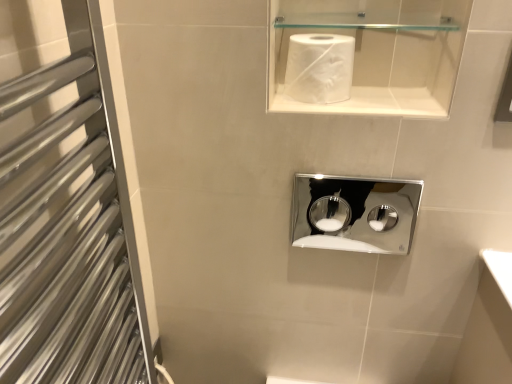
The image size is (512, 384). I want to click on white matte paper towel at upper center, so click(319, 68).

This screenshot has width=512, height=384. Identify the location of chrome/metallic medicine cabinet at center. (355, 213).

Based on the photo, visually, is silver metallic towel rack at left positioned to the left or to the right of chrome/metallic medicine cabinet at center?

Clearly, silver metallic towel rack at left is on the left of chrome/metallic medicine cabinet at center in the image.

From the image's perspective, who appears lower, silver metallic towel rack at left or chrome/metallic medicine cabinet at center?

silver metallic towel rack at left.

Considering the sizes of objects silver metallic towel rack at left and chrome/metallic medicine cabinet at center in the image provided, who is smaller, silver metallic towel rack at left or chrome/metallic medicine cabinet at center?

With smaller size is chrome/metallic medicine cabinet at center.

Between chrome/metallic medicine cabinet at center and white matte paper towel at upper center, which one has smaller size?

With smaller size is chrome/metallic medicine cabinet at center.

Find the location of a particular element. paper towel above the chrome/metallic medicine cabinet at center (from the image's perspective) is located at coordinates (319, 68).

From their relative heights in the image, would you say chrome/metallic medicine cabinet at center is taller or shorter than white matte paper towel at upper center?

chrome/metallic medicine cabinet at center is taller than white matte paper towel at upper center.

Is chrome/metallic medicine cabinet at center in front of or behind white matte paper towel at upper center in the image?

chrome/metallic medicine cabinet at center is positioned farther from the viewer than white matte paper towel at upper center.

Can you confirm if white matte paper towel at upper center is thinner than chrome/metallic medicine cabinet at center?

Incorrect, the width of white matte paper towel at upper center is not less than that of chrome/metallic medicine cabinet at center.

Can we say white matte paper towel at upper center lies outside chrome/metallic medicine cabinet at center?

Yes, white matte paper towel at upper center is not within chrome/metallic medicine cabinet at center.

From the picture: What's the angular difference between white matte paper towel at upper center and chrome/metallic medicine cabinet at center's facing directions?

white matte paper towel at upper center and chrome/metallic medicine cabinet at center are facing 1.37 degrees away from each other.

Does point (324, 54) come in front of point (393, 218)?

That is True.

How many degrees apart are the facing directions of silver metallic towel rack at left and white matte paper towel at upper center?

The angle between the facing direction of silver metallic towel rack at left and the facing direction of white matte paper towel at upper center is 88.9 degrees.

Which of these two, silver metallic towel rack at left or white matte paper towel at upper center, is smaller?

white matte paper towel at upper center is smaller.

Which point is more distant from viewer, (75, 164) or (344, 98)?

Point (344, 98)

Which object is positioned more to the right, silver metallic towel rack at left or white matte paper towel at upper center?

From the viewer's perspective, white matte paper towel at upper center appears more on the right side.

From a real-world perspective, is chrome/metallic medicine cabinet at center physically located above or below silver metallic towel rack at left?

chrome/metallic medicine cabinet at center is situated lower than silver metallic towel rack at left in the real world.

Is silver metallic towel rack at left located within chrome/metallic medicine cabinet at center?

No, silver metallic towel rack at left is not a part of chrome/metallic medicine cabinet at center.

Does point (302, 50) lie in front of point (127, 327)?

That is True.

Is white matte paper towel at upper center facing away from silver metallic towel rack at left?

white matte paper towel at upper center is not turned away from silver metallic towel rack at left.

How much distance is there between white matte paper towel at upper center and silver metallic towel rack at left?

white matte paper towel at upper center and silver metallic towel rack at left are 18.36 inches apart.

Would you say white matte paper towel at upper center is to the left or to the right of silver metallic towel rack at left in the picture?

Clearly, white matte paper towel at upper center is on the right of silver metallic towel rack at left in the image.

Identify the location of medicine cabinet lying behind the silver metallic towel rack at left. (355, 213).

Identify the location of medicine cabinet on the right of white matte paper towel at upper center. The width and height of the screenshot is (512, 384). (355, 213).

From the image, which object appears to be farther from white matte paper towel at upper center, silver metallic towel rack at left or chrome/metallic medicine cabinet at center?

Among the two, chrome/metallic medicine cabinet at center is located further to white matte paper towel at upper center.

When comparing their distances from white matte paper towel at upper center, does chrome/metallic medicine cabinet at center or silver metallic towel rack at left seem closer?

Based on the image, silver metallic towel rack at left appears to be nearer to white matte paper towel at upper center.

Considering their positions, is silver metallic towel rack at left positioned further to chrome/metallic medicine cabinet at center than white matte paper towel at upper center?

white matte paper towel at upper center is further to chrome/metallic medicine cabinet at center.

Which object lies further to the anchor point silver metallic towel rack at left, chrome/metallic medicine cabinet at center or white matte paper towel at upper center?

Based on the image, chrome/metallic medicine cabinet at center appears to be further to silver metallic towel rack at left.

Which object lies further to the anchor point silver metallic towel rack at left, white matte paper towel at upper center or chrome/metallic medicine cabinet at center?

Among the two, chrome/metallic medicine cabinet at center is located further to silver metallic towel rack at left.

Based on their spatial positions, is white matte paper towel at upper center or silver metallic towel rack at left further from chrome/metallic medicine cabinet at center?

white matte paper towel at upper center lies further to chrome/metallic medicine cabinet at center than the other object.

At what (x,y) coordinates should I click in order to perform the action: click on paper towel between silver metallic towel rack at left and chrome/metallic medicine cabinet at center from front to back. Please return your answer as a coordinate pair (x, y). Image resolution: width=512 pixels, height=384 pixels. Looking at the image, I should click on (319, 68).